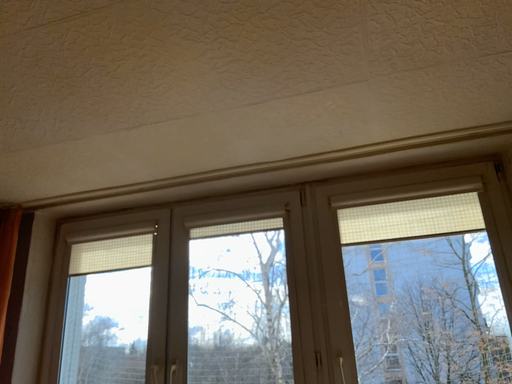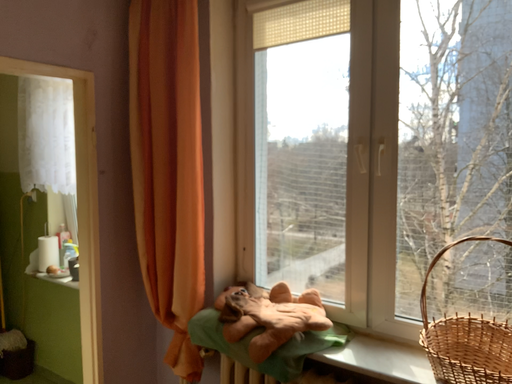
Question: Which way did the camera rotate in the video?

Choices:
 (A) rotated right
 (B) rotated left

Answer: (B)